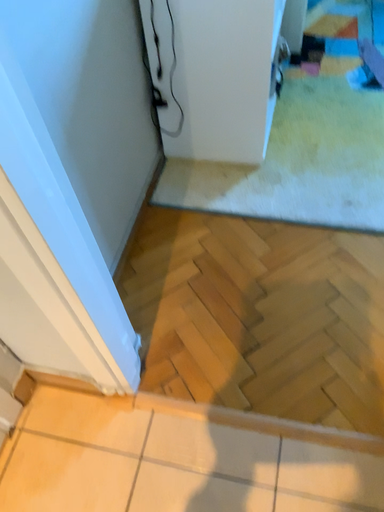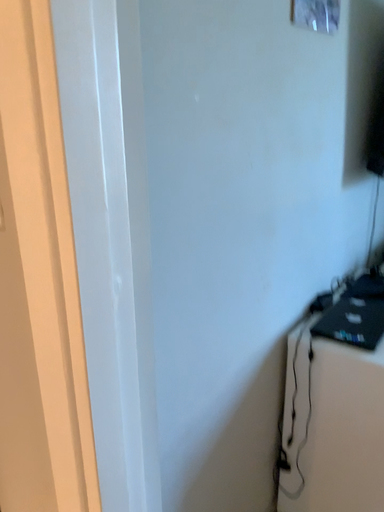
Question: How did the camera likely rotate when shooting the video?

Choices:
 (A) rotated right
 (B) rotated left

Answer: (B)